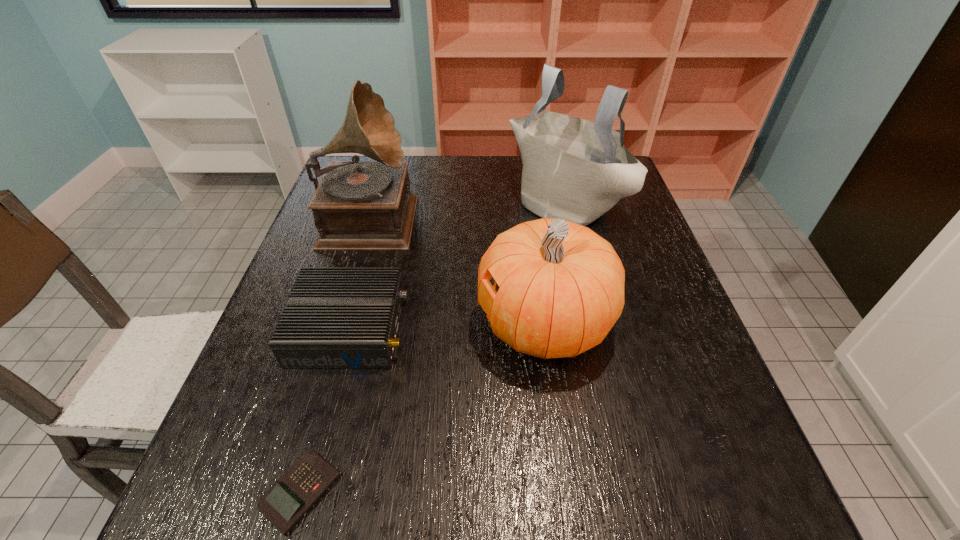
Image resolution: width=960 pixels, height=540 pixels. Identify the location of record player. (358, 205).

Identify the location of shopping bag. (573, 169).

Find the location of a particular element. The width and height of the screenshot is (960, 540). the third shortest object is located at coordinates (559, 287).

The width and height of the screenshot is (960, 540). I want to click on router, so [336, 317].

Identify the location of the nearest object. (298, 489).

Locate an element on the screen. This screenshot has width=960, height=540. the shortest object is located at coordinates (298, 489).

You are a GUI agent. You are given a task and a screenshot of the screen. Output one action in this format:
    pyautogui.click(x=<x>, y=<y>)
    Task: Click on the blank area located from the horn of the record player
    The height and width of the screenshot is (540, 960).
    Given the screenshot: What is the action you would take?
    pyautogui.click(x=432, y=215)

Locate an element on the screen. Image resolution: width=960 pixels, height=540 pixels. free space located on the front of the shopping bag is located at coordinates (583, 284).

Find the location of a particular element. vacant space located on the front-facing side of the third tallest object is located at coordinates (445, 323).

Identify the location of free location located on the front-facing side of the third tallest object. Image resolution: width=960 pixels, height=540 pixels. (432, 323).